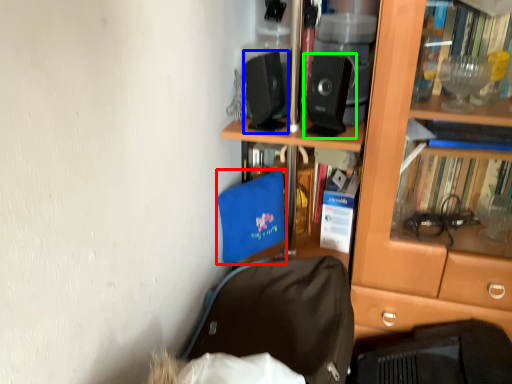
Question: Which is farther away from luggage and bags (highlighted by a red box)? loudspeaker (highlighted by a blue box) or loudspeaker (highlighted by a green box)?

Choices:
 (A) loudspeaker
 (B) loudspeaker

Answer: (B)